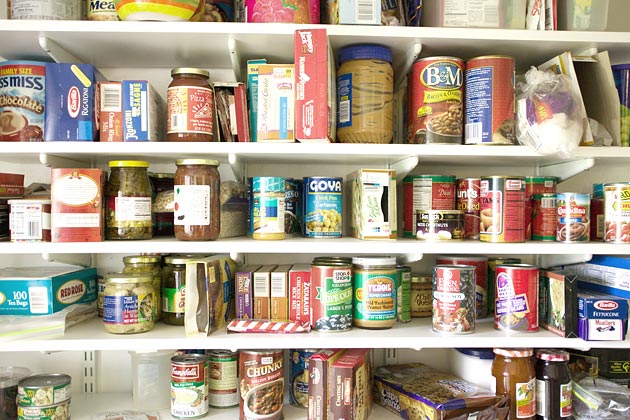
At what (x,y) coordinates should I click in order to perform the action: click on plastic containers. Please return your answer as a coordinate pair (x, y). The width and height of the screenshot is (630, 420). Looking at the image, I should click on (6, 389), (152, 374), (472, 368), (602, 11), (496, 12), (232, 219).